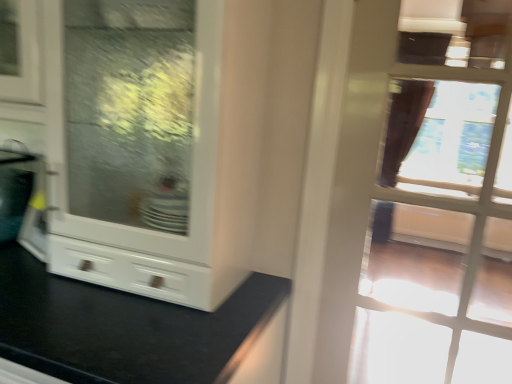
Question: Does transparent glass door at upper right have a smaller size compared to white glossy cabinet at center?

Choices:
 (A) yes
 (B) no

Answer: (A)

Question: Is transparent glass door at upper right oriented away from white glossy cabinet at center?

Choices:
 (A) no
 (B) yes

Answer: (A)

Question: Does transparent glass door at upper right come in front of white glossy cabinet at center?

Choices:
 (A) yes
 (B) no

Answer: (B)

Question: Is transparent glass door at upper right shorter than white glossy cabinet at center?

Choices:
 (A) yes
 (B) no

Answer: (A)

Question: Considering the relative positions of transparent glass door at upper right and white glossy cabinet at center in the image provided, is transparent glass door at upper right to the right of white glossy cabinet at center from the viewer's perspective?

Choices:
 (A) yes
 (B) no

Answer: (A)

Question: Is transparent glass door at upper right wider than white glossy cabinet at center?

Choices:
 (A) no
 (B) yes

Answer: (A)

Question: From the image's perspective, is white glossy cabinet at center over transparent glass door at upper right?

Choices:
 (A) no
 (B) yes

Answer: (A)

Question: Considering the relative sizes of white glossy cabinet at center and transparent glass door at upper right in the image provided, is white glossy cabinet at center smaller than transparent glass door at upper right?

Choices:
 (A) yes
 (B) no

Answer: (B)

Question: Can we say white glossy cabinet at center lies outside transparent glass door at upper right?

Choices:
 (A) no
 (B) yes

Answer: (B)

Question: Does white glossy cabinet at center have a greater height compared to transparent glass door at upper right?

Choices:
 (A) no
 (B) yes

Answer: (B)

Question: Considering the relative sizes of white glossy cabinet at center and transparent glass door at upper right in the image provided, is white glossy cabinet at center bigger than transparent glass door at upper right?

Choices:
 (A) no
 (B) yes

Answer: (B)

Question: Is white glossy cabinet at center looking in the opposite direction of transparent glass door at upper right?

Choices:
 (A) yes
 (B) no

Answer: (B)

Question: Is point (446, 243) closer or farther from the camera than point (228, 251)?

Choices:
 (A) farther
 (B) closer

Answer: (A)